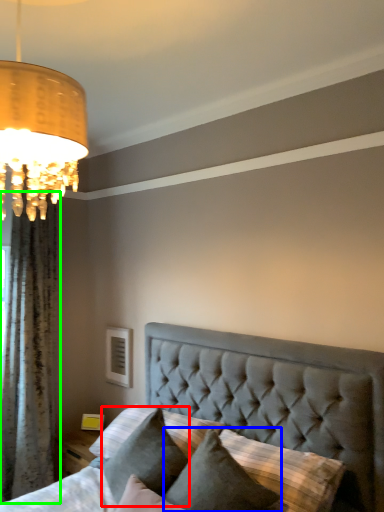
Question: Which object is positioned closest to pillow (highlighted by a red box)? Select from pillow (highlighted by a blue box) and curtain (highlighted by a green box).

Choices:
 (A) pillow
 (B) curtain

Answer: (A)